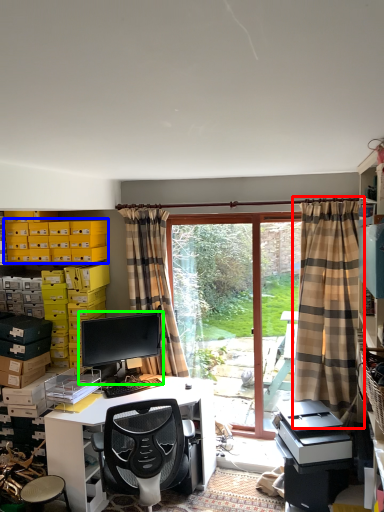
Question: Considering the real-world distances, which object is closest to curtain (highlighted by a red box)? storage box (highlighted by a blue box) or computer monitor (highlighted by a green box).

Choices:
 (A) storage box
 (B) computer monitor

Answer: (B)